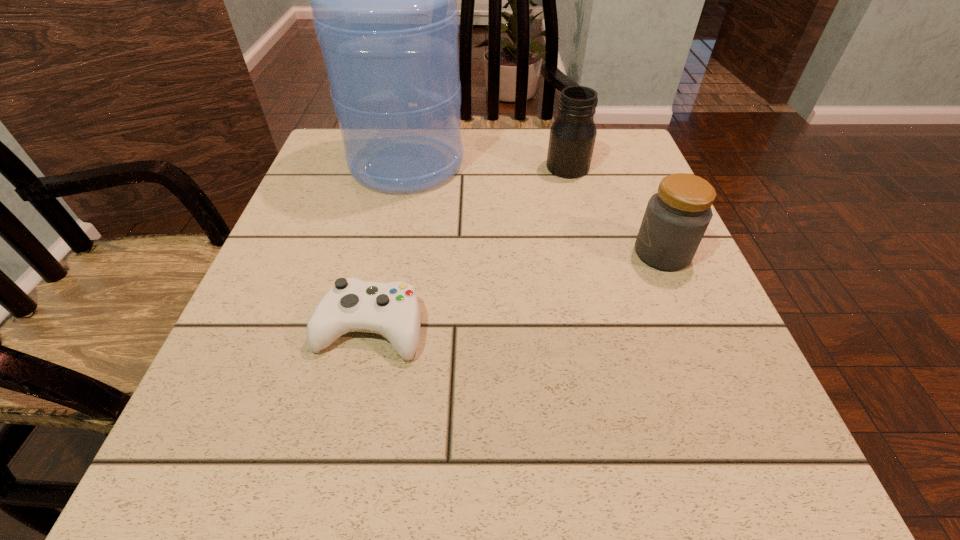
Locate an element on the screen. free space at the left edge of the desktop is located at coordinates (314, 282).

Find the location of `blank space at the right edge of the desktop`. blank space at the right edge of the desktop is located at coordinates (614, 287).

In the image, there is a desktop. At what (x,y) coordinates should I click in order to perform the action: click on blank space at the near left corner. Please return your answer as a coordinate pair (x, y). Looking at the image, I should click on (176, 501).

In the image, there is a desktop. Identify the location of blank space at the far right corner. (634, 145).

Image resolution: width=960 pixels, height=540 pixels. I want to click on free space between the tallest object and the control, so click(x=388, y=246).

The image size is (960, 540). Find the location of `free point between the shortest object and the water jug`. free point between the shortest object and the water jug is located at coordinates (388, 246).

The image size is (960, 540). I want to click on free point between the left jar and the nearer jar, so click(615, 210).

You are a GUI agent. You are given a task and a screenshot of the screen. Output one action in this format:
    pyautogui.click(x=<x>, y=<y>)
    Task: Click on the vacant space in between the rightmost object and the water jug
    Image resolution: width=960 pixels, height=540 pixels.
    Given the screenshot: What is the action you would take?
    pyautogui.click(x=535, y=208)

Where is `empty location between the shortest object and the second object from right to left`? This screenshot has width=960, height=540. empty location between the shortest object and the second object from right to left is located at coordinates (468, 247).

Locate an element on the screen. Image resolution: width=960 pixels, height=540 pixels. vacant space in between the second object from right to left and the shortest object is located at coordinates (468, 247).